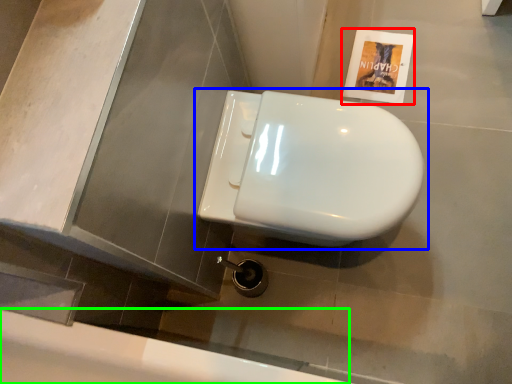
Question: Which object is positioned closest to flyer (highlighted by a red box)? Select from toilet (highlighted by a blue box) and bath (highlighted by a green box).

Choices:
 (A) toilet
 (B) bath

Answer: (A)